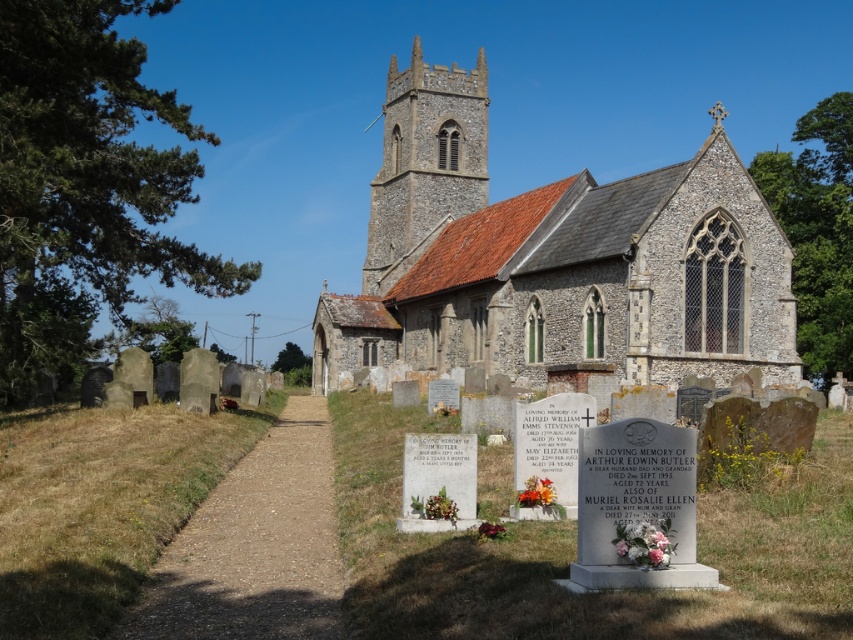
Identify the location of stone church at center. This screenshot has width=853, height=640. (553, 259).

Is stone church at center positioned in front of stone steeple at center?

That is True.

Is point (608, 244) positioned before point (428, 170)?

Yes, point (608, 244) is in front of point (428, 170).

This screenshot has width=853, height=640. I want to click on stone church at center, so click(553, 259).